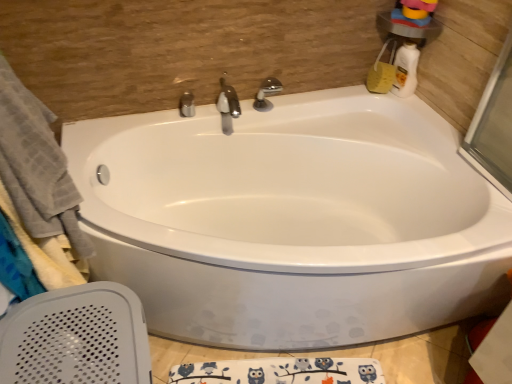
Question: Should I look upward or downward to see polished chrome faucet at center, acting as the third tap starting from the right?

Choices:
 (A) up
 (B) down

Answer: (A)

Question: Can you confirm if white glossy bottle at upper right is bigger than white glossy bathtub at center?

Choices:
 (A) no
 (B) yes

Answer: (A)

Question: Can you confirm if white glossy bottle at upper right is thinner than white glossy bathtub at center?

Choices:
 (A) no
 (B) yes

Answer: (B)

Question: From a real-world perspective, is white glossy bottle at upper right under white glossy bathtub at center?

Choices:
 (A) yes
 (B) no

Answer: (B)

Question: Is white glossy bottle at upper right behind white glossy bathtub at center?

Choices:
 (A) yes
 (B) no

Answer: (A)

Question: From a real-world perspective, is white glossy bottle at upper right physically above white glossy bathtub at center?

Choices:
 (A) yes
 (B) no

Answer: (A)

Question: Is white glossy bathtub at center completely or partially inside white glossy bottle at upper right?

Choices:
 (A) yes
 (B) no

Answer: (B)

Question: Is the position of satin nickel faucet at center, the second tap in the left-to-right sequence, less distant than that of gray cotton towel at left?

Choices:
 (A) yes
 (B) no

Answer: (B)

Question: From the image's perspective, would you say satin nickel faucet at center, positioned as the second tap in right-to-left order, is shown under gray cotton towel at left?

Choices:
 (A) yes
 (B) no

Answer: (B)

Question: Considering the relative sizes of satin nickel faucet at center, positioned as the second tap in right-to-left order, and gray cotton towel at left in the image provided, is satin nickel faucet at center, positioned as the second tap in right-to-left order, taller than gray cotton towel at left?

Choices:
 (A) yes
 (B) no

Answer: (B)

Question: Is satin nickel faucet at center, positioned as the second tap in right-to-left order, not close to gray cotton towel at left?

Choices:
 (A) no
 (B) yes

Answer: (A)

Question: Is satin nickel faucet at center, the second tap in the left-to-right sequence, facing away from gray cotton towel at left?

Choices:
 (A) no
 (B) yes

Answer: (A)

Question: From a real-world perspective, does satin nickel faucet at center, positioned as the second tap in right-to-left order, sit lower than gray cotton towel at left?

Choices:
 (A) yes
 (B) no

Answer: (A)

Question: Is satin nickel faucet at center, positioned as the second tap in right-to-left order, smaller than white glossy bottle at upper right?

Choices:
 (A) no
 (B) yes

Answer: (A)